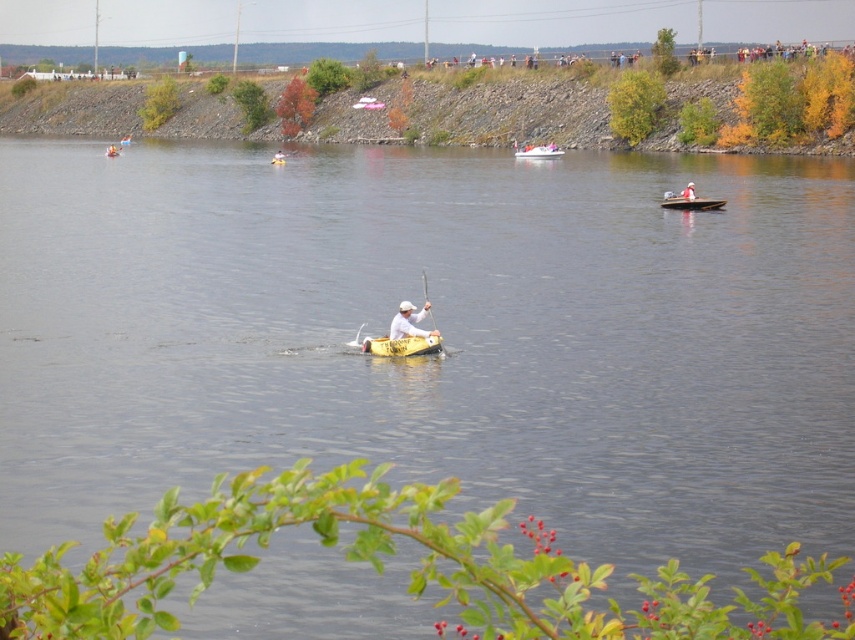
Can you confirm if white matte kayak at center is bigger than yellow plastic boat at center?

Indeed, white matte kayak at center has a larger size compared to yellow plastic boat at center.

Does white matte kayak at center have a lesser width compared to yellow plastic boat at center?

No, white matte kayak at center is not thinner than yellow plastic boat at center.

Describe the element at coordinates (410, 321) in the screenshot. I see `white matte kayak at center` at that location.

Locate an element on the screen. The width and height of the screenshot is (855, 640). white matte kayak at center is located at coordinates (410, 321).

Is yellow matte canoe at center wider than white matte kayak at center?

Correct, the width of yellow matte canoe at center exceeds that of white matte kayak at center.

Can you confirm if yellow matte canoe at center is bigger than white matte kayak at center?

Yes, yellow matte canoe at center is bigger than white matte kayak at center.

I want to click on yellow matte canoe at center, so (401, 346).

Is yellow matte canoe at center further to the viewer compared to yellow plastic boat at center?

No, yellow matte canoe at center is in front of yellow plastic boat at center.

Is point (394, 355) less distant than point (547, 147)?

Yes, it is.

At what (x,y) coordinates should I click in order to perform the action: click on yellow matte canoe at center. Please return your answer as a coordinate pair (x, y). Image resolution: width=855 pixels, height=640 pixels. Looking at the image, I should click on (401, 346).